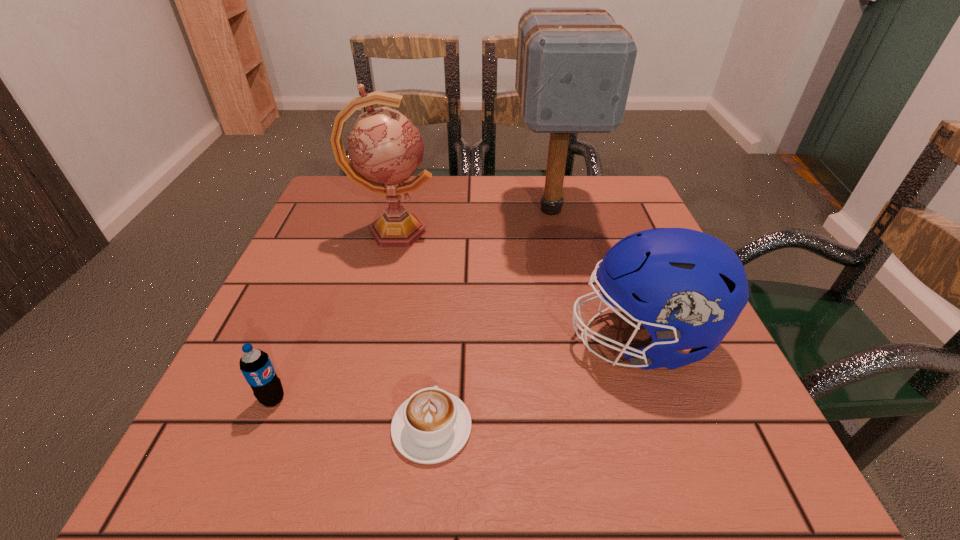
In the image, there is a desktop. Where is `vacant area at the near left corner`? vacant area at the near left corner is located at coordinates (257, 477).

In the image, there is a desktop. In order to click on free space at the far right corner in this screenshot , I will do `click(626, 176)`.

Find the location of a particular element. This screenshot has height=540, width=960. vacant area that lies between the cappuccino and the second shortest object is located at coordinates (352, 413).

Find the location of a particular element. The width and height of the screenshot is (960, 540). free space between the globe and the third farthest object is located at coordinates (517, 286).

At what (x,y) coordinates should I click in order to perform the action: click on vacant area that lies between the shortest object and the second tallest object. Please return your answer as a coordinate pair (x, y). This screenshot has height=540, width=960. Looking at the image, I should click on (413, 329).

Locate an element on the screen. The height and width of the screenshot is (540, 960). vacant area between the tallest object and the globe is located at coordinates (472, 220).

Where is `empty space between the second tallest object and the fourth tallest object`? empty space between the second tallest object and the fourth tallest object is located at coordinates (333, 315).

Find the location of a particular element. This screenshot has height=540, width=960. vacant space that's between the football helmet and the second shortest object is located at coordinates point(457,369).

This screenshot has height=540, width=960. Identify the location of unoccupied position between the soda bottle and the globe. (333, 315).

Find the location of a particular element. free point between the second shortest object and the third nearest object is located at coordinates (457, 369).